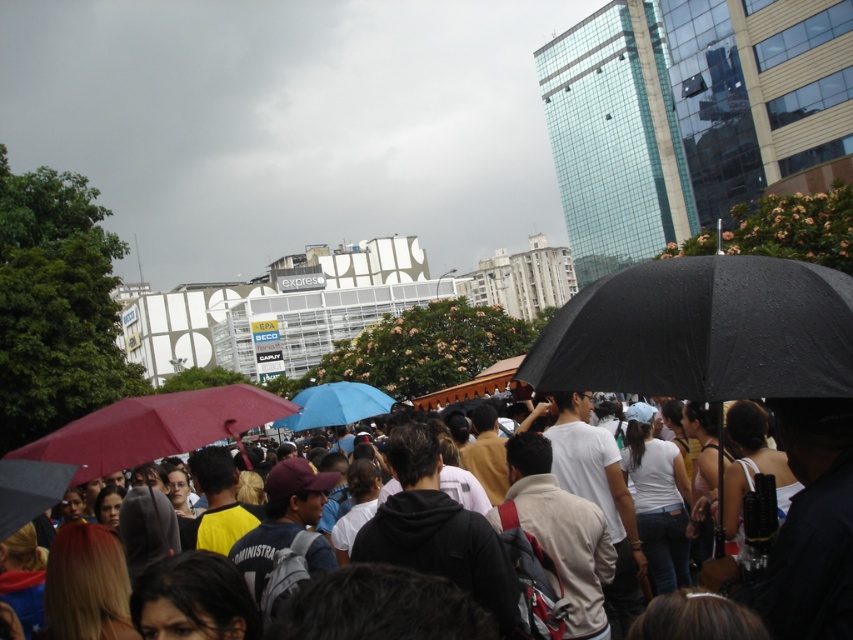
Which is below, black matte umbrella at center or blue matte umbrella at center?

blue matte umbrella at center

Based on the photo, is black matte umbrella at center to the left of blue matte umbrella at center from the viewer's perspective?

In fact, black matte umbrella at center is to the right of blue matte umbrella at center.

Find the location of `black matte umbrella at center`. black matte umbrella at center is located at coordinates (701, 332).

Can you confirm if black matte umbrella at center is positioned above matte black umbrella at center?

Correct, black matte umbrella at center is located above matte black umbrella at center.

Based on the photo, who is more distant from viewer, (598, 385) or (846, 618)?

The point (598, 385) is more distant.

Locate an element on the screen. This screenshot has height=640, width=853. black matte umbrella at center is located at coordinates (701, 332).

Can you confirm if matte black umbrella at center is bigger than matte red umbrella at lower left?

No, matte black umbrella at center is not bigger than matte red umbrella at lower left.

Is point (820, 600) farther from viewer compared to point (144, 451)?

No, it is in front of (144, 451).

The width and height of the screenshot is (853, 640). What do you see at coordinates (811, 524) in the screenshot?
I see `matte black umbrella at center` at bounding box center [811, 524].

Where is `matte black umbrella at center`? This screenshot has height=640, width=853. matte black umbrella at center is located at coordinates (811, 524).